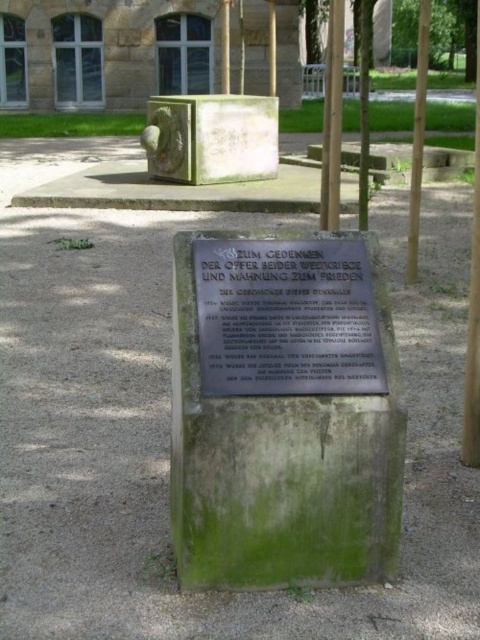
Between green mossy stone plaque at center and green wood pole at right, which one has more height?

green wood pole at right

This screenshot has height=640, width=480. What do you see at coordinates (282, 468) in the screenshot? I see `green mossy stone plaque at center` at bounding box center [282, 468].

Between point (184, 486) and point (418, 67), which one is positioned in front?

Point (184, 486) is more forward.

Locate an element on the screen. The width and height of the screenshot is (480, 640). green mossy stone plaque at center is located at coordinates (282, 468).

Is green mossy stone plaque at center thinner than green stone safe at upper center?

Indeed, green mossy stone plaque at center has a lesser width compared to green stone safe at upper center.

Which is behind, point (220, 456) or point (265, 160)?

The point (265, 160) is behind.

I want to click on green mossy stone plaque at center, so click(x=282, y=468).

Who is more distant from viewer, (x=253, y=262) or (x=474, y=392)?

Point (x=474, y=392)

Is bronze plaque at center wider than brown wooden pole at center?

Incorrect, bronze plaque at center's width does not surpass brown wooden pole at center's.

Where is `bronze plaque at center`? Image resolution: width=480 pixels, height=640 pixels. bronze plaque at center is located at coordinates (286, 317).

What are the coordinates of `bronze plaque at center` in the screenshot? It's located at (286, 317).